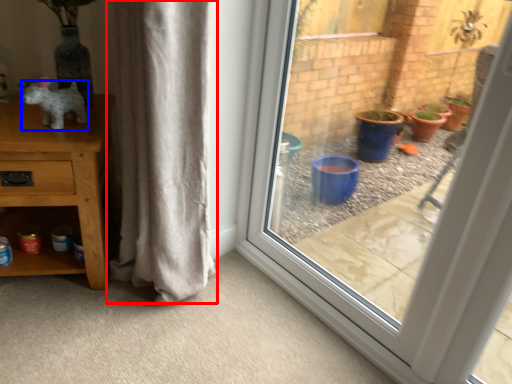
Question: Which of the following is the closest to the observer, curtain (highlighted by a red box) or animal (highlighted by a blue box)?

Choices:
 (A) curtain
 (B) animal

Answer: (A)